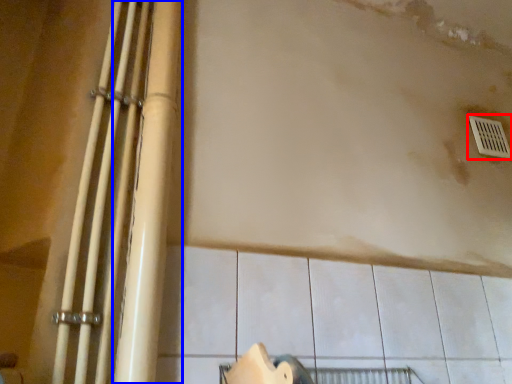
Question: Which object is further to the camera taking this photo, window (highlighted by a red box) or beam (highlighted by a blue box)?

Choices:
 (A) window
 (B) beam

Answer: (A)